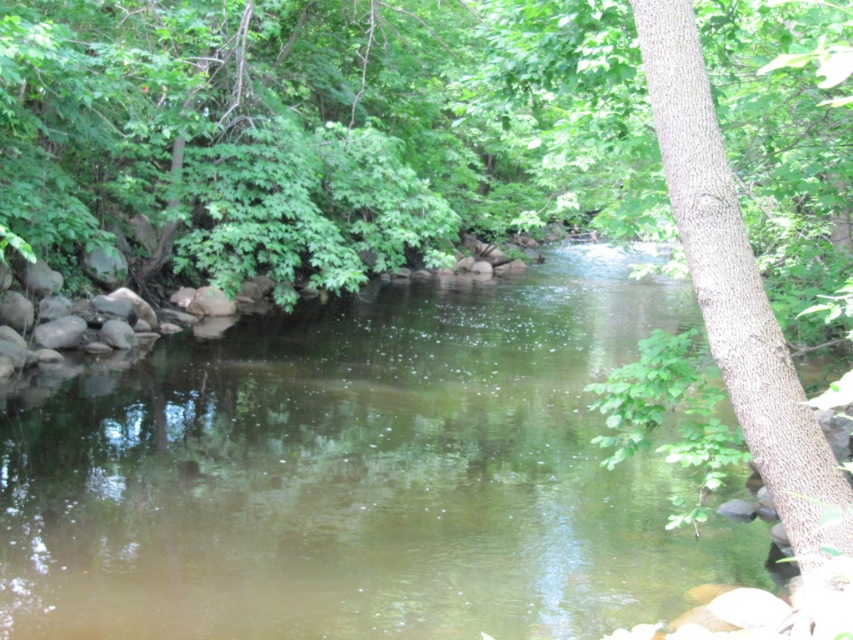
Question: Can you confirm if green smooth water at center is positioned above brown textured tree trunk at right?

Choices:
 (A) yes
 (B) no

Answer: (B)

Question: Is green smooth water at center to the right of brown textured tree trunk at right from the viewer's perspective?

Choices:
 (A) no
 (B) yes

Answer: (A)

Question: Which object appears closest to the camera in this image?

Choices:
 (A) brown textured tree trunk at right
 (B) green smooth water at center

Answer: (A)

Question: Which point is closer to the camera?

Choices:
 (A) (821, 518)
 (B) (64, 557)

Answer: (A)

Question: Can you confirm if green smooth water at center is positioned above brown textured tree trunk at right?

Choices:
 (A) no
 (B) yes

Answer: (A)